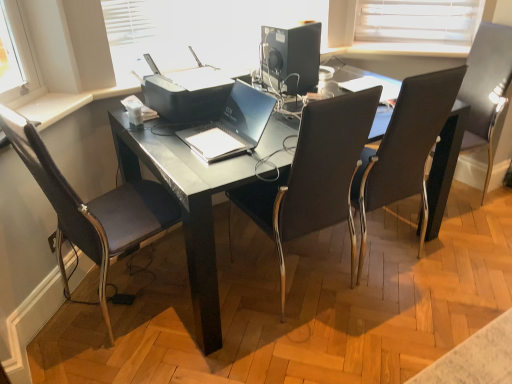
Where is `vacant space to the right of satin black laptop at center`? vacant space to the right of satin black laptop at center is located at coordinates (278, 135).